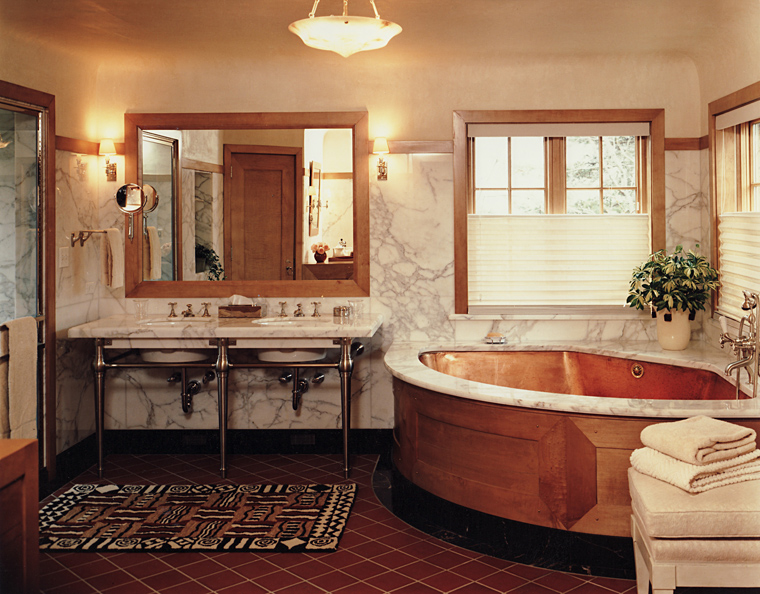
Locate an element on the screen. blinds is located at coordinates (574, 267), (745, 263).